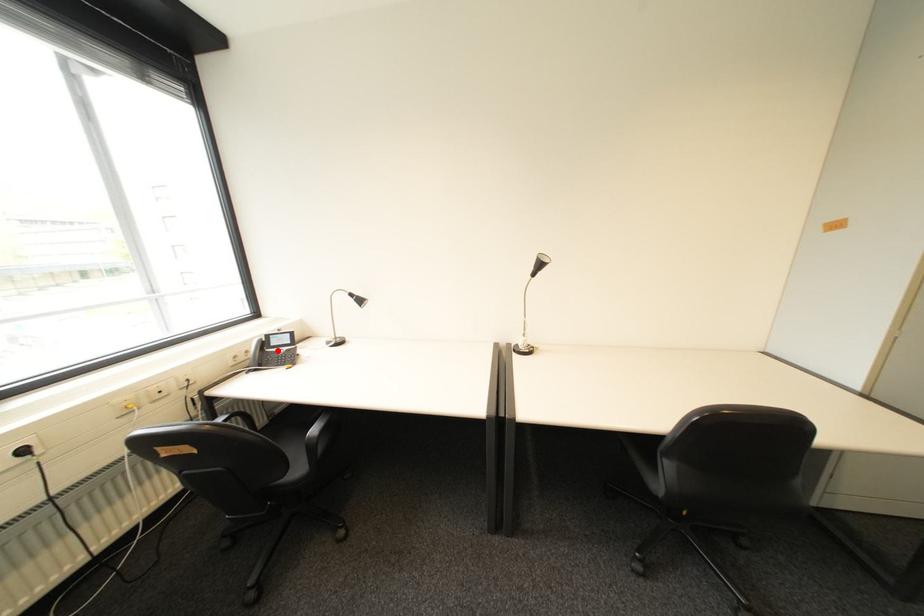
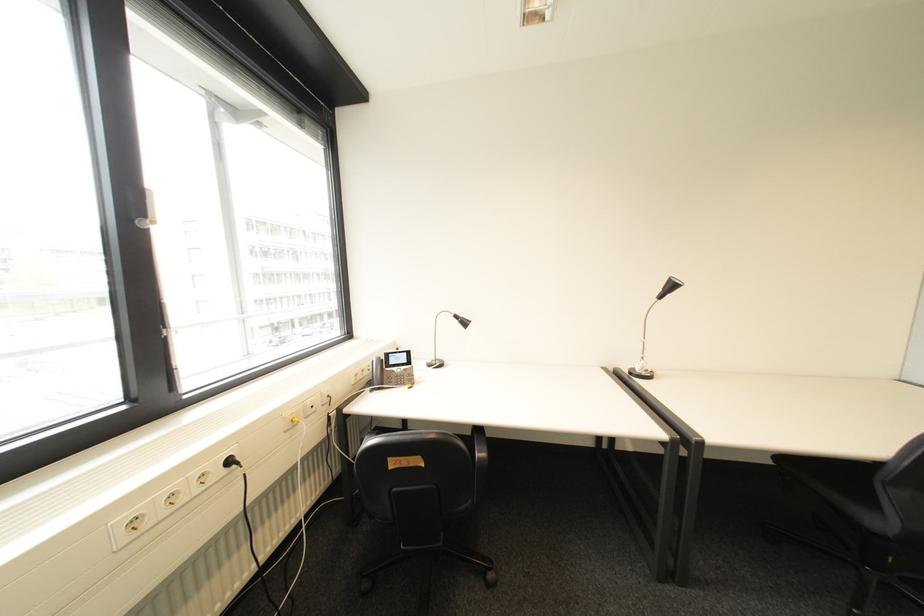
Question: I am providing you with two images of the same scene from different viewpoints. A red point is shown in image1. For the corresponding object point in image2, is it positioned nearer or farther from the camera?

Choices:
 (A) Nearer
 (B) Farther

Answer: (B)